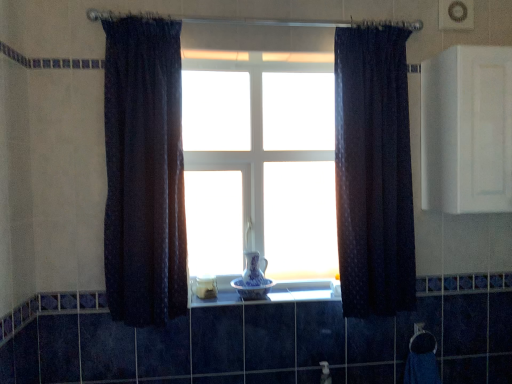
Question: Considering the positions of point (244, 274) and point (498, 122), is point (244, 274) closer or farther from the camera than point (498, 122)?

Choices:
 (A) closer
 (B) farther

Answer: (B)

Question: Looking at the image, does blue porcelain vase at center, the first glass vase in the top-to-bottom sequence, seem bigger or smaller compared to white matte cabinet at upper right?

Choices:
 (A) small
 (B) big

Answer: (A)

Question: Considering the real-world distances, which object is farthest from the blue porcelain vase at center, which ranks as the first glass vase in bottom-to-top order?

Choices:
 (A) white glossy bowl at center
 (B) white matte cabinet at upper right
 (C) dark textured curtain at left, placed as the 1th curtain when sorted from left to right
 (D) blue porcelain vase at center, the first glass vase in the top-to-bottom sequence
 (E) white glass vase at center

Answer: (B)

Question: Which is nearer to the white matte cabinet at upper right?

Choices:
 (A) white glass vase at center
 (B) blue porcelain vase at center, the first glass vase in the top-to-bottom sequence
 (C) blue porcelain vase at center, which ranks as the first glass vase in bottom-to-top order
 (D) white glossy bowl at center
 (E) dark blue textured curtain at center, which is the 2th curtain from left to right

Answer: (E)